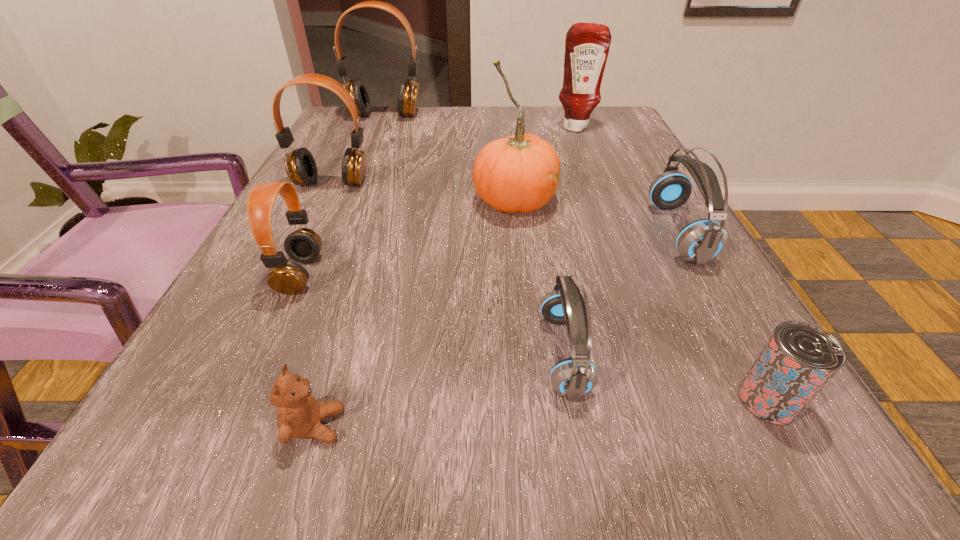
The width and height of the screenshot is (960, 540). Identify the location of the tallest headset. (408, 91).

The width and height of the screenshot is (960, 540). Identify the location of the farthest brown headset. pyautogui.click(x=408, y=91).

You are a GUI agent. You are given a task and a screenshot of the screen. Output one action in this format:
    pyautogui.click(x=<x>, y=<y>)
    Task: Click on the pumpkin
    The image size is (960, 540).
    Given the screenshot: What is the action you would take?
    pyautogui.click(x=520, y=173)

What are the coordinates of `the third object from right to left` in the screenshot? It's located at (587, 45).

Locate an element on the screen. The image size is (960, 540). condiment is located at coordinates (587, 45).

Where is `the second farthest headset`? the second farthest headset is located at coordinates (300, 165).

You are a GUI agent. You are given a task and a screenshot of the screen. Output one action in this format:
    pyautogui.click(x=<x>, y=<y>)
    Task: Click on the second biggest brown headset
    The width and height of the screenshot is (960, 540).
    Given the screenshot: What is the action you would take?
    pyautogui.click(x=300, y=165)

Where is `the smallest brown headset`? Image resolution: width=960 pixels, height=540 pixels. the smallest brown headset is located at coordinates click(303, 245).

Locate an element on the screen. the rightmost headset is located at coordinates (700, 241).

This screenshot has width=960, height=540. I want to click on the farther blue headset, so click(x=700, y=241).